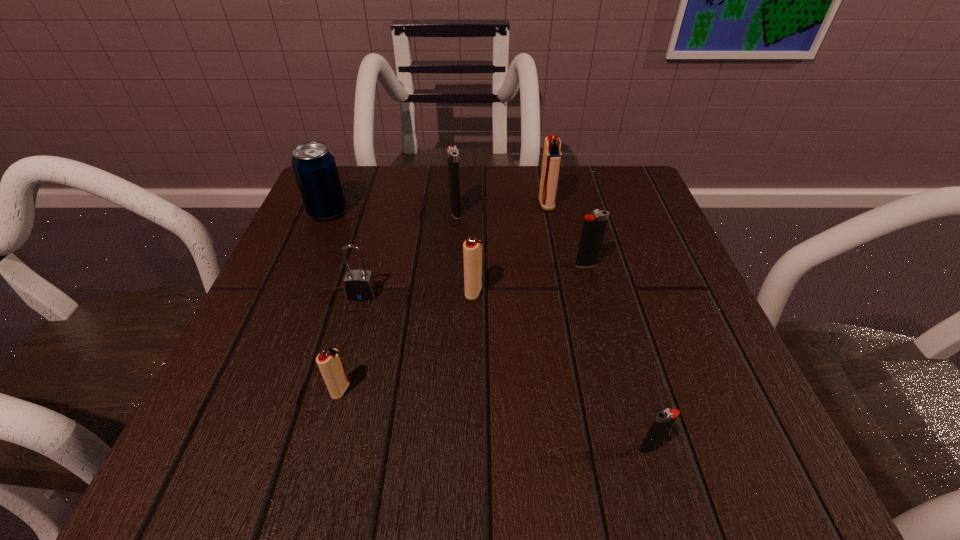
Where is `free spot at the near edge of the desktop`? The height and width of the screenshot is (540, 960). free spot at the near edge of the desktop is located at coordinates pyautogui.click(x=553, y=421).

Locate an element on the screen. The height and width of the screenshot is (540, 960). free space at the left edge is located at coordinates (248, 366).

The image size is (960, 540). Find the location of `vacant area at the right edge of the desktop`. vacant area at the right edge of the desktop is located at coordinates (684, 300).

This screenshot has height=540, width=960. In the image, there is a desktop. Identify the location of vacant space at the far left corner. (378, 191).

Find the location of a particular element. free spot at the near left corner of the desktop is located at coordinates (228, 446).

This screenshot has width=960, height=540. I want to click on free space at the far right corner of the desktop, so coord(641,217).

The image size is (960, 540). I want to click on vacant point located between the second igniter from left to right and the seventh farthest object, so click(x=398, y=301).

Locate an element on the screen. The width and height of the screenshot is (960, 540). free space between the fourth object from left to right and the padlock is located at coordinates (409, 253).

This screenshot has height=540, width=960. What are the coordinates of `vacant area between the smallest red igniter and the fourth object from right to left` in the screenshot? It's located at (407, 341).

You are a GUI agent. You are given a task and a screenshot of the screen. Output one action in this format:
    pyautogui.click(x=<x>, y=<y>)
    Task: Click on the free point between the rightmost red igniter and the leftmost object
    The height and width of the screenshot is (540, 960).
    Given the screenshot: What is the action you would take?
    pyautogui.click(x=437, y=208)